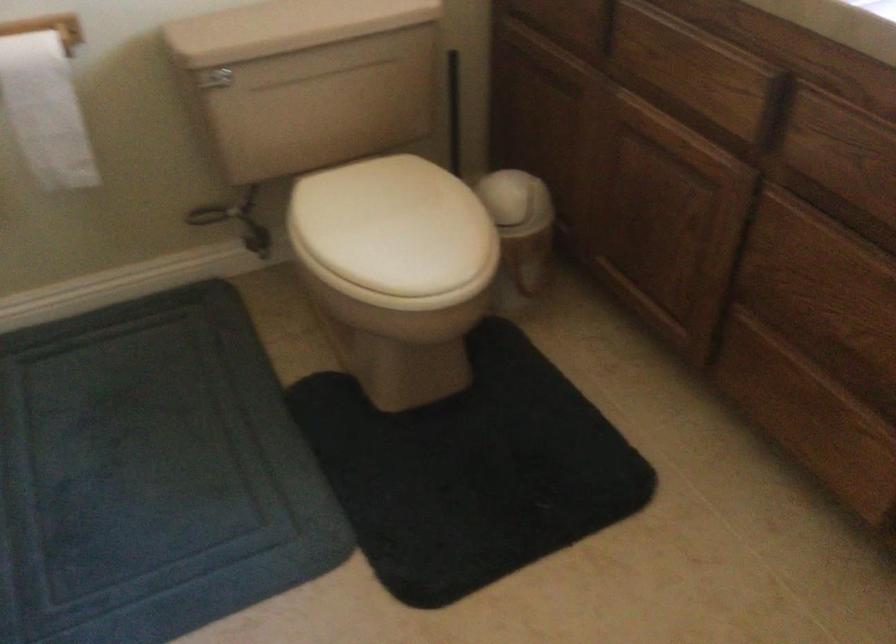
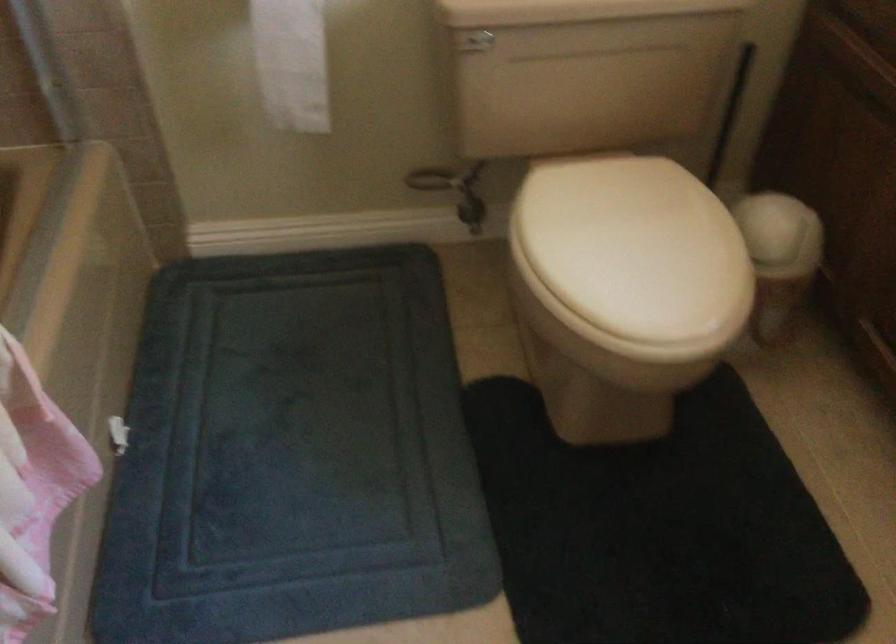
Locate, in the second image, the point that corresponds to point (255, 239) in the first image.

(471, 211)